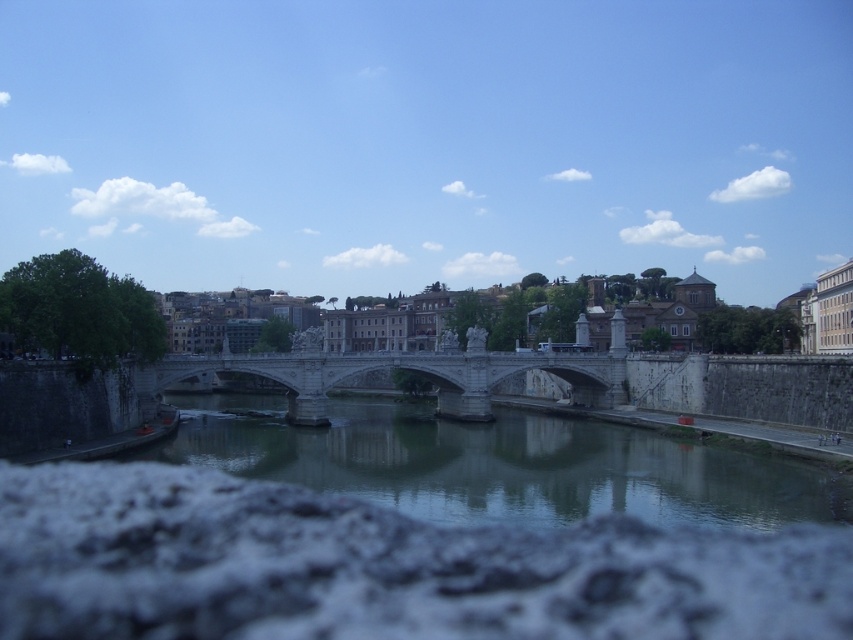
Does smooth concrete river at center have a larger size compared to stone bridge at center?

Yes, smooth concrete river at center is bigger than stone bridge at center.

Identify the location of smooth concrete river at center. The image size is (853, 640). (502, 465).

This screenshot has height=640, width=853. I want to click on smooth concrete river at center, so click(502, 465).